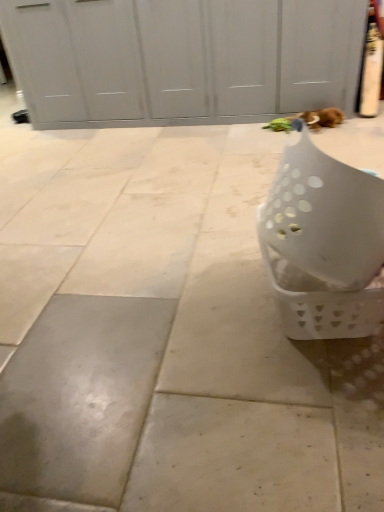
The image size is (384, 512). Describe the element at coordinates (320, 301) in the screenshot. I see `white plastic basket at lower right` at that location.

Where is `white plastic basket at lower right`? This screenshot has width=384, height=512. white plastic basket at lower right is located at coordinates (320, 301).

You are a GUI agent. You are given a task and a screenshot of the screen. Output one action in this format:
    pyautogui.click(x=<x>, y=<y>)
    Task: Click on the brown plush cat at upper right
    Image resolution: width=384 pixels, height=512 pixels.
    Given the screenshot: What is the action you would take?
    320,118

Describe the element at coordinates (320, 118) in the screenshot. I see `brown plush cat at upper right` at that location.

The image size is (384, 512). I want to click on white plastic basket at lower right, so click(320, 301).

Between brown plush cat at upper right and white plastic basket at lower right, which one appears on the left side from the viewer's perspective?

white plastic basket at lower right is more to the left.

Is brown plush cat at upper right behind white plastic basket at lower right?

Yes, brown plush cat at upper right is behind white plastic basket at lower right.

Considering the points (331, 123) and (348, 304), which point is in front, point (331, 123) or point (348, 304)?

The point (348, 304) is closer.

From the image's perspective, is brown plush cat at upper right positioned above or below white plastic basket at lower right?

brown plush cat at upper right is above white plastic basket at lower right.

From a real-world perspective, who is located lower, brown plush cat at upper right or white plastic basket at lower right?

brown plush cat at upper right, from a real-world perspective.

In terms of width, does brown plush cat at upper right look wider or thinner when compared to white plastic basket at lower right?

Considering their sizes, brown plush cat at upper right looks slimmer than white plastic basket at lower right.

Which of these two, brown plush cat at upper right or white plastic basket at lower right, stands shorter?

brown plush cat at upper right is shorter.

Does brown plush cat at upper right have a smaller size compared to white plastic basket at lower right?

Indeed, brown plush cat at upper right has a smaller size compared to white plastic basket at lower right.

In the scene shown: Would you say white plastic basket at lower right is part of brown plush cat at upper right's contents?

No, white plastic basket at lower right is not surrounded by brown plush cat at upper right.

Can you see brown plush cat at upper right touching white plastic basket at lower right?

No, brown plush cat at upper right is not making contact with white plastic basket at lower right.

Is white plastic basket at lower right at the back of brown plush cat at upper right?

No, brown plush cat at upper right is not facing the opposite direction of white plastic basket at lower right.

How many degrees apart are the facing directions of brown plush cat at upper right and white plastic basket at lower right?

brown plush cat at upper right and white plastic basket at lower right are facing 82 degrees away from each other.

This screenshot has height=512, width=384. Find the location of `cat that is under the white plastic basket at lower right (from a real-world perspective)`. cat that is under the white plastic basket at lower right (from a real-world perspective) is located at coordinates (320, 118).

Does white plastic basket at lower right appear on the left side of brown plush cat at upper right?

Yes, white plastic basket at lower right is to the left of brown plush cat at upper right.

In the scene shown: In the image, is white plastic basket at lower right positioned in front of or behind brown plush cat at upper right?

white plastic basket at lower right is in front of brown plush cat at upper right.

Which point is more distant from viewer, (334, 294) or (327, 113)?

The point (327, 113) is farther from the camera.

From the image's perspective, is white plastic basket at lower right below brown plush cat at upper right?

Indeed, from the image's perspective, white plastic basket at lower right is shown beneath brown plush cat at upper right.

From a real-world perspective, is white plastic basket at lower right physically above brown plush cat at upper right?

Indeed, from a real-world perspective, white plastic basket at lower right stands above brown plush cat at upper right.

From the picture: Does white plastic basket at lower right have a lesser width compared to brown plush cat at upper right?

No.

Can you confirm if white plastic basket at lower right is taller than brown plush cat at upper right?

Indeed, white plastic basket at lower right has a greater height compared to brown plush cat at upper right.

Based on the photo, who is smaller, white plastic basket at lower right or brown plush cat at upper right?

Smaller between the two is brown plush cat at upper right.

Does white plastic basket at lower right contain brown plush cat at upper right?

Definitely not — brown plush cat at upper right is not inside white plastic basket at lower right.

Is there a large distance between white plastic basket at lower right and brown plush cat at upper right?

Yes, white plastic basket at lower right and brown plush cat at upper right are quite far apart.

Is white plastic basket at lower right oriented towards brown plush cat at upper right?

No.

This screenshot has width=384, height=512. Find the location of `cat that appears on the right of white plastic basket at lower right`. cat that appears on the right of white plastic basket at lower right is located at coordinates [x=320, y=118].

The image size is (384, 512). In order to click on cat below the white plastic basket at lower right (from a real-world perspective) in this screenshot , I will do `click(320, 118)`.

Where is `cat behind the white plastic basket at lower right`? This screenshot has height=512, width=384. cat behind the white plastic basket at lower right is located at coordinates (320, 118).